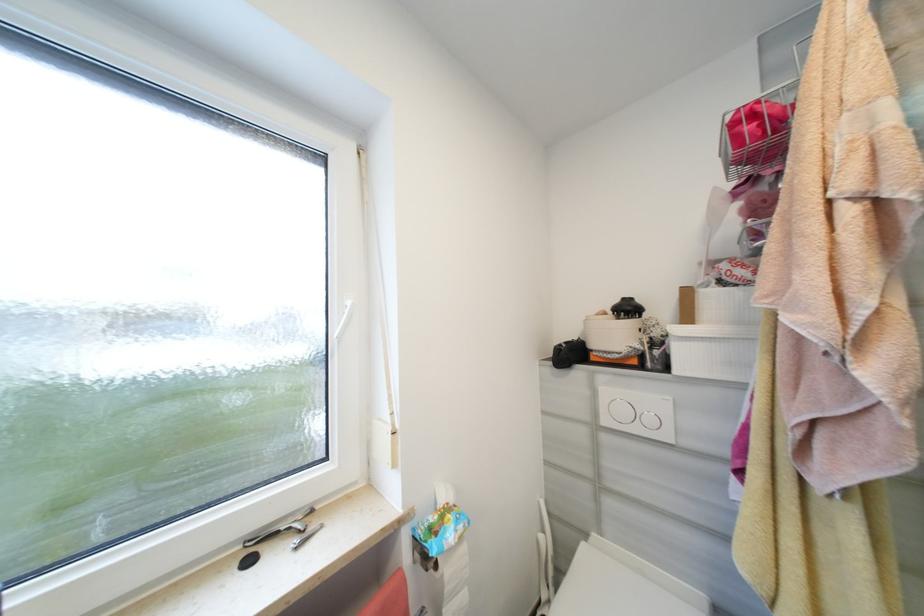
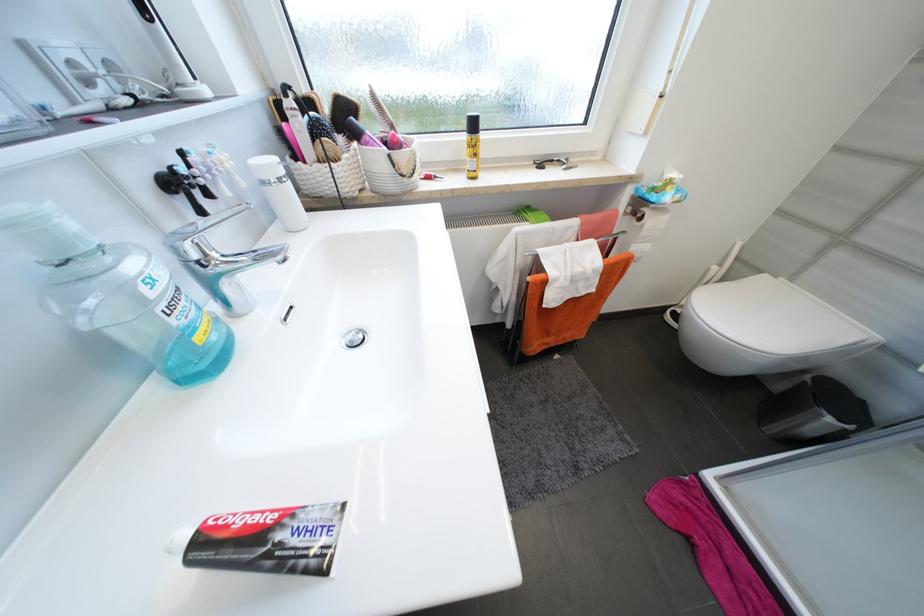
Find the pixel in the second image that matches pixel 284 533 in the first image.

(558, 161)